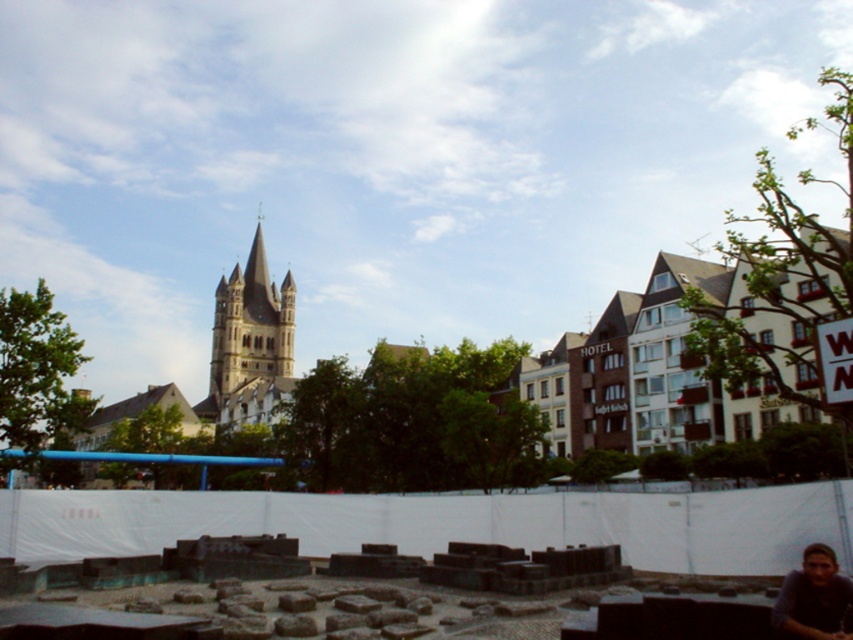
In the scene shown: You are a tourist in the town square and want to take a photo of the golden stone tower at center without any people in the frame. The blurred skin face at lower right is currently blocking the view. Can you suggest a way to avoid the face?

The golden stone tower at center is bigger than the blurred skin face at lower right, so you can move to a position where the tower is framed in a way that the smaller face is out of the shot, or wait until the person moves.

You are a tourist standing in the town square. You see the golden stone tower at center and the blurred skin face at lower right. Which object is wider?

The golden stone tower at center is wider than the blurred skin face at lower right.